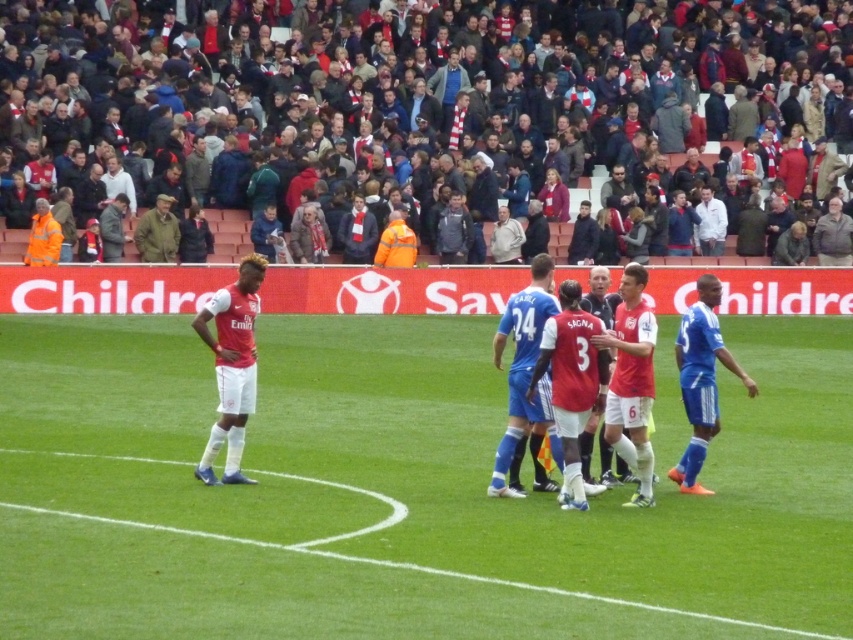
Question: Does matte red jersey at left have a greater width compared to khaki fabric jacket at center?

Choices:
 (A) no
 (B) yes

Answer: (A)

Question: Can you confirm if blue synthetic soccer player at right is positioned to the right of khaki fabric jacket at center?

Choices:
 (A) yes
 (B) no

Answer: (A)

Question: Which point is farther from the camera taking this photo?

Choices:
 (A) (210, 467)
 (B) (172, 257)
 (C) (610, 307)
 (D) (526, 412)

Answer: (B)

Question: Is green grass field at center above red jersey at center?

Choices:
 (A) yes
 (B) no

Answer: (B)

Question: Which of the following is the closest to the observer?

Choices:
 (A) (689, 346)
 (B) (641, 396)

Answer: (B)

Question: Which is nearer to the blue jersey at center?

Choices:
 (A) matte red jersey at left
 (B) red scarf at upper center
 (C) red matte jersey at center

Answer: (C)